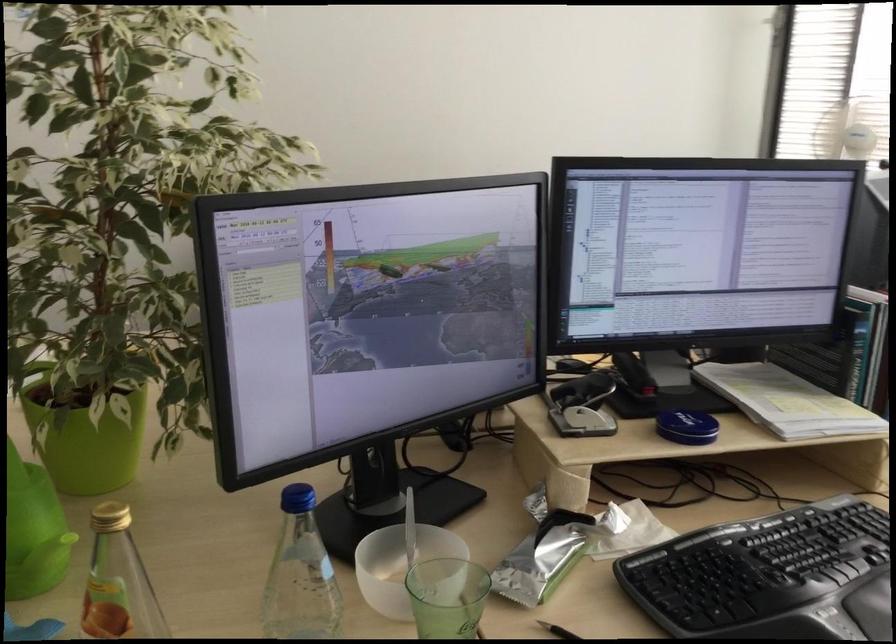
At what (x,y) coordinates should I click in order to perform the action: click on small juice bottle. Please return your answer as a coordinate pair (x, y). Looking at the image, I should click on (300, 574).